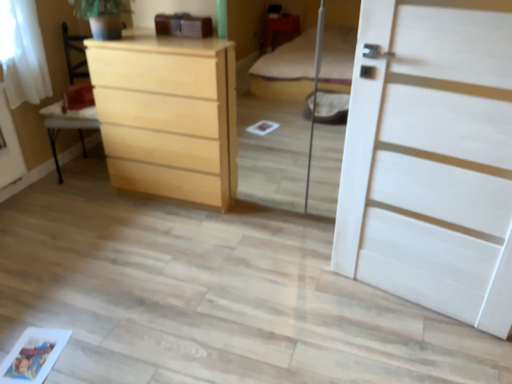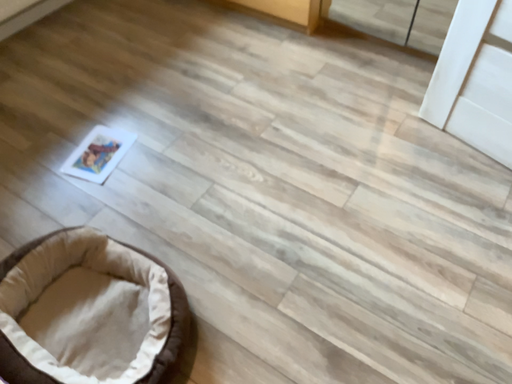
Question: How did the camera likely rotate when shooting the video?

Choices:
 (A) rotated downward
 (B) rotated upward

Answer: (A)